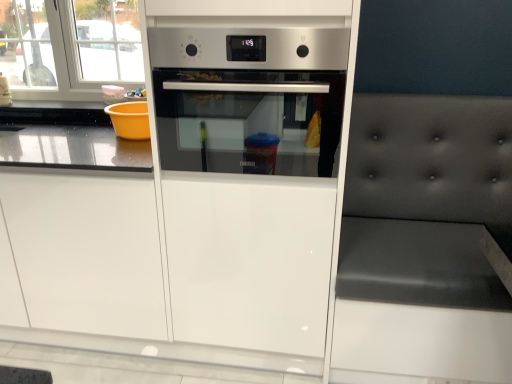
Question: Should I look upward or downward to see white glossy drawer at center?

Choices:
 (A) down
 (B) up

Answer: (A)

Question: Does satin silver oven at center appear on the left side of white glossy drawer at center?

Choices:
 (A) yes
 (B) no

Answer: (B)

Question: Is satin silver oven at center facing towards white glossy drawer at center?

Choices:
 (A) no
 (B) yes

Answer: (A)

Question: Is satin silver oven at center bigger than white glossy drawer at center?

Choices:
 (A) yes
 (B) no

Answer: (A)

Question: Can you confirm if satin silver oven at center is smaller than white glossy drawer at center?

Choices:
 (A) no
 (B) yes

Answer: (A)

Question: Can you confirm if satin silver oven at center is wider than white glossy drawer at center?

Choices:
 (A) no
 (B) yes

Answer: (B)

Question: Is satin silver oven at center looking in the opposite direction of white glossy drawer at center?

Choices:
 (A) yes
 (B) no

Answer: (B)

Question: Is white glossy drawer at center wider than satin silver oven at center?

Choices:
 (A) no
 (B) yes

Answer: (A)

Question: From a real-world perspective, is white glossy drawer at center positioned under satin silver oven at center based on gravity?

Choices:
 (A) no
 (B) yes

Answer: (B)

Question: Does white glossy drawer at center have a lesser width compared to satin silver oven at center?

Choices:
 (A) no
 (B) yes

Answer: (B)

Question: Is white glossy drawer at center not within satin silver oven at center?

Choices:
 (A) no
 (B) yes

Answer: (B)

Question: Is white glossy drawer at center shorter than satin silver oven at center?

Choices:
 (A) yes
 (B) no

Answer: (B)

Question: Is satin silver oven at center at the back of white glossy drawer at center?

Choices:
 (A) no
 (B) yes

Answer: (A)

Question: Is dark gray tufted cushion at right not inside satin silver oven at center?

Choices:
 (A) no
 (B) yes

Answer: (B)